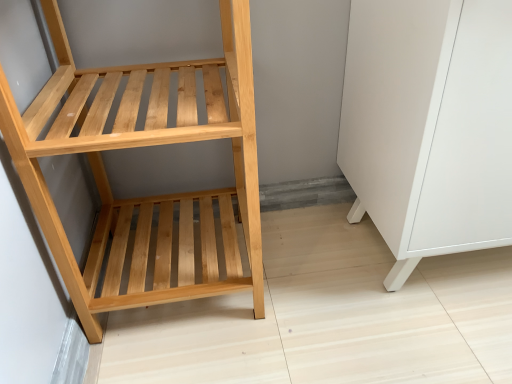
Describe the element at coordinates (143, 146) in the screenshot. I see `natural wood shelf at left` at that location.

Locate an element on the screen. The height and width of the screenshot is (384, 512). natural wood shelf at left is located at coordinates (143, 146).

This screenshot has height=384, width=512. Describe the element at coordinates (429, 125) in the screenshot. I see `white matte cabinet at lower right` at that location.

I want to click on white matte cabinet at lower right, so click(429, 125).

The width and height of the screenshot is (512, 384). What are the coordinates of `natural wood shelf at left` in the screenshot? It's located at (143, 146).

Which object is positioned more to the right, white matte cabinet at lower right or natural wood shelf at left?

white matte cabinet at lower right is more to the right.

Considering the relative positions of white matte cabinet at lower right and natural wood shelf at left in the image provided, is white matte cabinet at lower right behind natural wood shelf at left?

Yes, white matte cabinet at lower right is further from the viewer.

Considering the points (428, 66) and (244, 11), which point is in front, point (428, 66) or point (244, 11)?

The point (244, 11) is in front.

From the image's perspective, which one is positioned higher, white matte cabinet at lower right or natural wood shelf at left?

white matte cabinet at lower right is shown above in the image.

From a real-world perspective, is white matte cabinet at lower right on top of natural wood shelf at left?

Actually, white matte cabinet at lower right is physically below natural wood shelf at left in the real world.

Considering the sizes of white matte cabinet at lower right and natural wood shelf at left in the image, is white matte cabinet at lower right wider or thinner than natural wood shelf at left?

white matte cabinet at lower right is wider than natural wood shelf at left.

Who is taller, white matte cabinet at lower right or natural wood shelf at left?

natural wood shelf at left.

Which of these two, white matte cabinet at lower right or natural wood shelf at left, is bigger?

white matte cabinet at lower right.

Would you say white matte cabinet at lower right is outside natural wood shelf at left?

Yes, white matte cabinet at lower right is outside of natural wood shelf at left.

Are white matte cabinet at lower right and natural wood shelf at left located far from each other?

white matte cabinet at lower right is actually quite close to natural wood shelf at left.

Is natural wood shelf at left at the back of white matte cabinet at lower right?

No, white matte cabinet at lower right is not facing the opposite direction of natural wood shelf at left.

What's the angular difference between white matte cabinet at lower right and natural wood shelf at left's facing directions?

The angle between the facing direction of white matte cabinet at lower right and the facing direction of natural wood shelf at left is 0.768 degrees.

Measure the distance from white matte cabinet at lower right to natural wood shelf at left.

white matte cabinet at lower right and natural wood shelf at left are 14.21 inches apart.

Image resolution: width=512 pixels, height=384 pixels. What are the coordinates of `file cabinet to the right of natural wood shelf at left` in the screenshot? It's located at (429, 125).

Is natural wood shelf at left to the left or to the right of white matte cabinet at lower right in the image?

natural wood shelf at left is positioned on white matte cabinet at lower right's left side.

In the image, is natural wood shelf at left positioned in front of or behind white matte cabinet at lower right?

Visually, natural wood shelf at left is located in front of white matte cabinet at lower right.

Considering the positions of point (150, 145) and point (463, 159), is point (150, 145) closer or farther from the camera than point (463, 159)?

Point (150, 145).

From the image's perspective, is natural wood shelf at left located above white matte cabinet at lower right?

No, from the image's perspective, natural wood shelf at left is not on top of white matte cabinet at lower right.

From a real-world perspective, is natural wood shelf at left on white matte cabinet at lower right?

Yes, from a real-world perspective, natural wood shelf at left is above white matte cabinet at lower right.

Considering the sizes of natural wood shelf at left and white matte cabinet at lower right in the image, is natural wood shelf at left wider or thinner than white matte cabinet at lower right?

Considering their sizes, natural wood shelf at left looks slimmer than white matte cabinet at lower right.

Considering the relative sizes of natural wood shelf at left and white matte cabinet at lower right in the image provided, is natural wood shelf at left shorter than white matte cabinet at lower right?

Incorrect, the height of natural wood shelf at left does not fall short of that of white matte cabinet at lower right.

In terms of size, does natural wood shelf at left appear bigger or smaller than white matte cabinet at lower right?

Clearly, natural wood shelf at left is smaller in size than white matte cabinet at lower right.

Is natural wood shelf at left spatially inside white matte cabinet at lower right, or outside of it?

The correct answer is: outside.

Are natural wood shelf at left and white matte cabinet at lower right located far from each other?

natural wood shelf at left is actually quite close to white matte cabinet at lower right.

Does natural wood shelf at left turn towards white matte cabinet at lower right?

No, natural wood shelf at left does not turn towards white matte cabinet at lower right.

What's the angular difference between natural wood shelf at left and white matte cabinet at lower right's facing directions?

They differ by 0.768 degrees in their facing directions.

I want to click on furniture below the white matte cabinet at lower right (from the image's perspective), so click(143, 146).

Image resolution: width=512 pixels, height=384 pixels. In order to click on file cabinet beneath the natural wood shelf at left (from a real-world perspective) in this screenshot , I will do `click(429, 125)`.

Where is `furniture that is above the white matte cabinet at lower right (from a real-world perspective)`? The image size is (512, 384). furniture that is above the white matte cabinet at lower right (from a real-world perspective) is located at coordinates (143, 146).